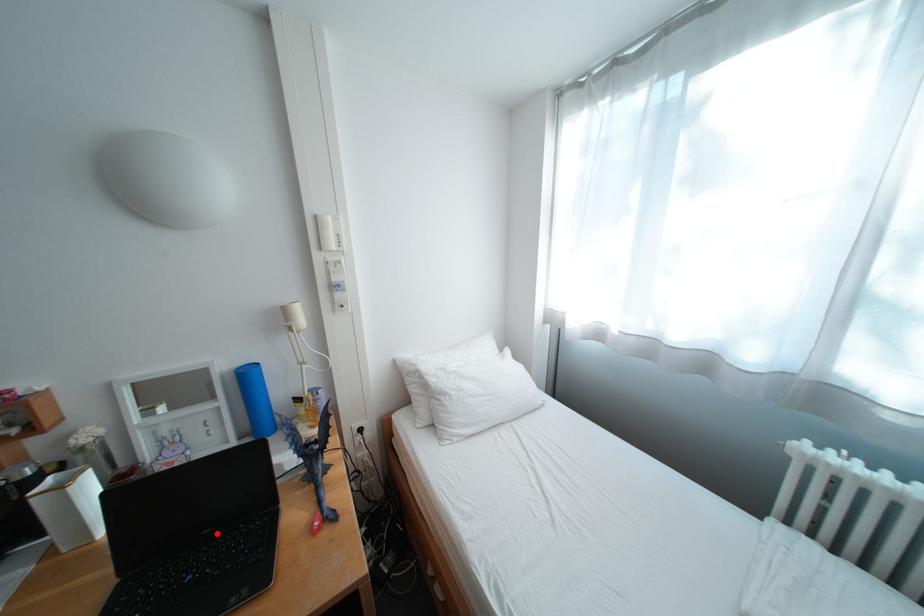
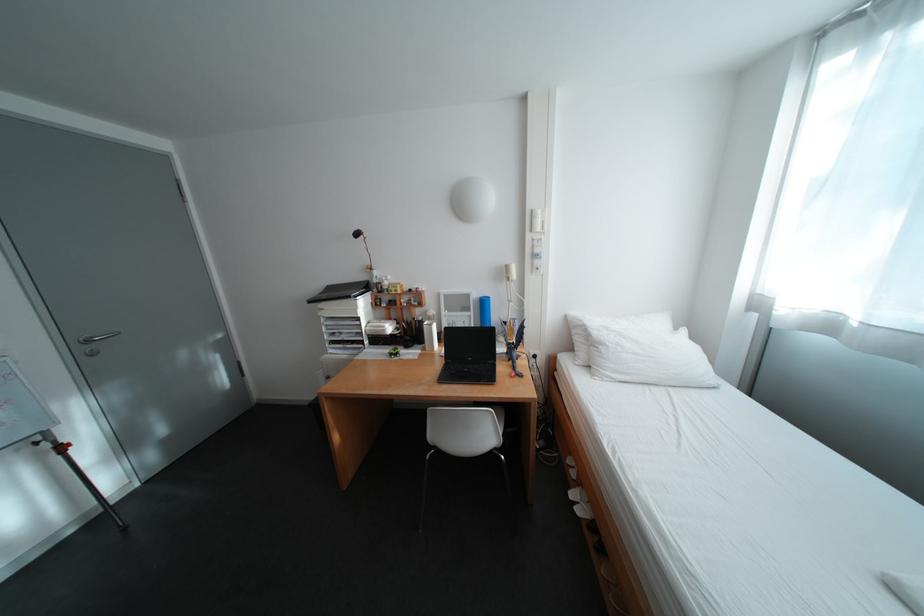
Where in the second image is the point corresponding to the highlighted location from the first image?

(481, 360)